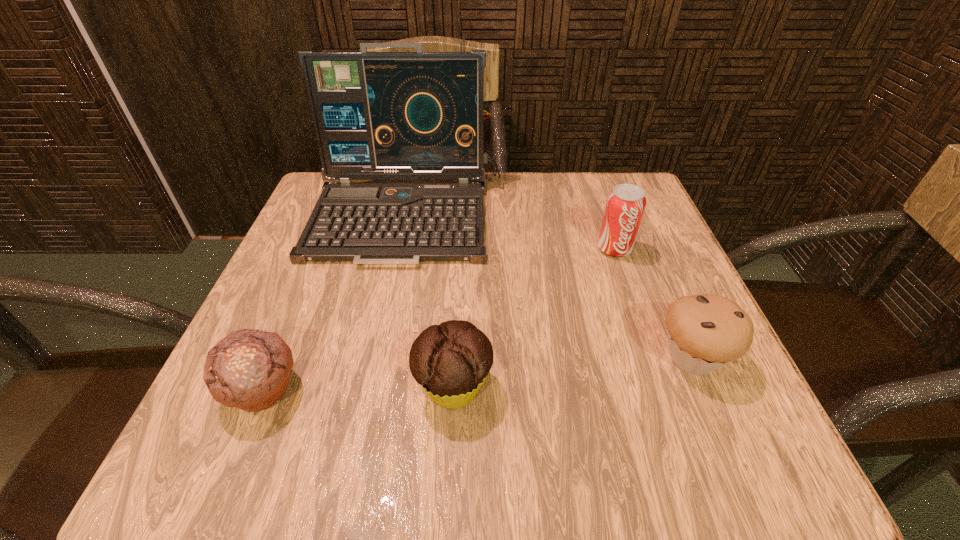
The image size is (960, 540). I want to click on blank area at the right edge, so click(725, 369).

You are a GUI agent. You are given a task and a screenshot of the screen. Output one action in this format:
    pyautogui.click(x=<x>, y=<y>)
    Task: Click on the free location at the near left corner
    
    Given the screenshot: What is the action you would take?
    pyautogui.click(x=271, y=457)

At what (x,y) coordinates should I click in order to perform the action: click on free location at the far right corner of the desktop. Please return your answer as a coordinate pair (x, y). Looking at the image, I should click on [x=607, y=194].

Locate an element on the screen. free space between the tallest object and the rightmost muffin is located at coordinates (550, 287).

Where is `free space between the rightmost muffin and the tallest object`? The height and width of the screenshot is (540, 960). free space between the rightmost muffin and the tallest object is located at coordinates (550, 287).

Identify the location of vacant space that is in between the second muffin from right to left and the rightmost muffin. The height and width of the screenshot is (540, 960). (573, 373).

Where is `free spot between the second tallest object and the laptop computer`? The height and width of the screenshot is (540, 960). free spot between the second tallest object and the laptop computer is located at coordinates (511, 232).

Locate an element on the screen. vacant space that is in between the tallest object and the second muffin from right to left is located at coordinates (431, 302).

Where is `empty location between the second muffin from right to left and the second tallest object`? empty location between the second muffin from right to left and the second tallest object is located at coordinates click(534, 318).

Identify the location of empty space between the laptop computer and the leftmost muffin. (335, 303).